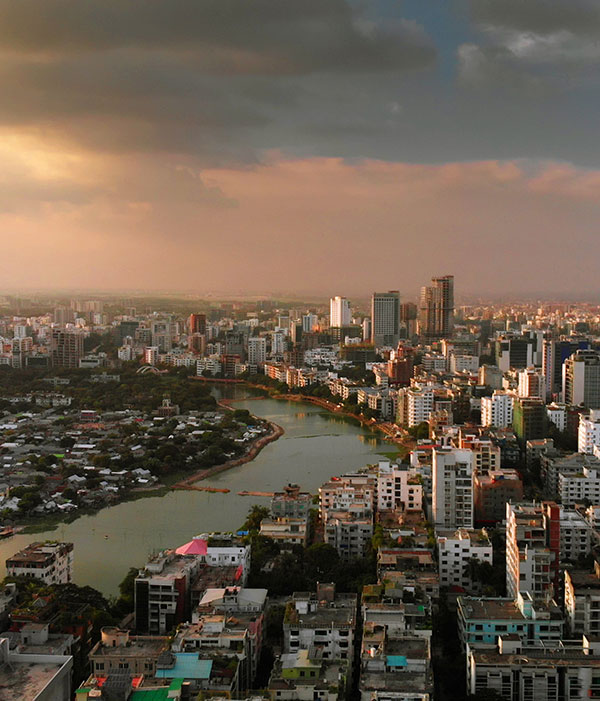
This screenshot has width=600, height=701. What are the coordinates of `window` in the screenshot? It's located at (412, 491).